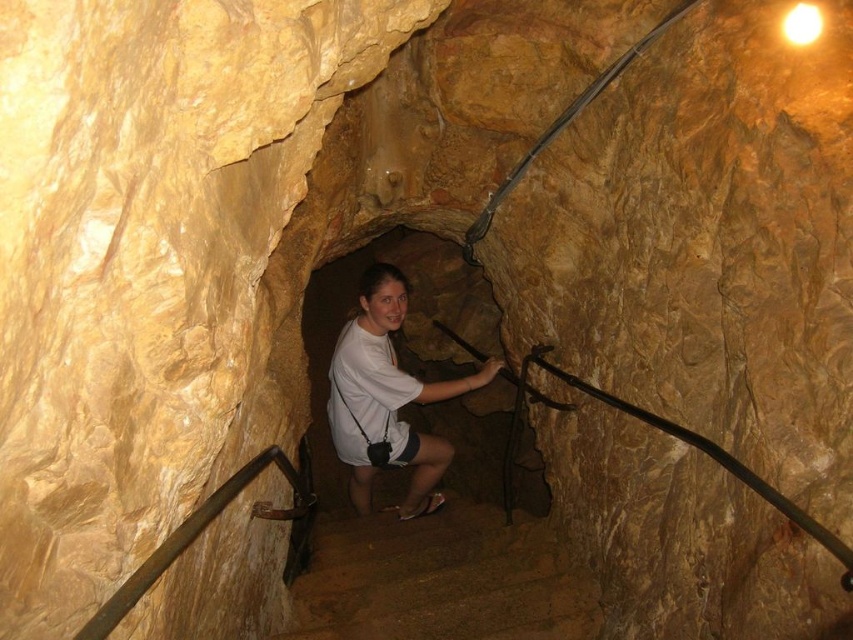
Question: Does brown stone stairs at center have a larger size compared to white matte shirt at center?

Choices:
 (A) no
 (B) yes

Answer: (A)

Question: Does brown stone stairs at center lie in front of white matte shirt at center?

Choices:
 (A) no
 (B) yes

Answer: (B)

Question: Is brown stone stairs at center wider than white matte shirt at center?

Choices:
 (A) no
 (B) yes

Answer: (B)

Question: Among these points, which one is farthest from the camera?

Choices:
 (A) (386, 273)
 (B) (477, 518)

Answer: (B)

Question: Which point is farther to the camera?

Choices:
 (A) brown stone stairs at center
 (B) white matte shirt at center

Answer: (B)

Question: Which object is closer to the camera taking this photo?

Choices:
 (A) brown stone stairs at center
 (B) white matte shirt at center

Answer: (A)